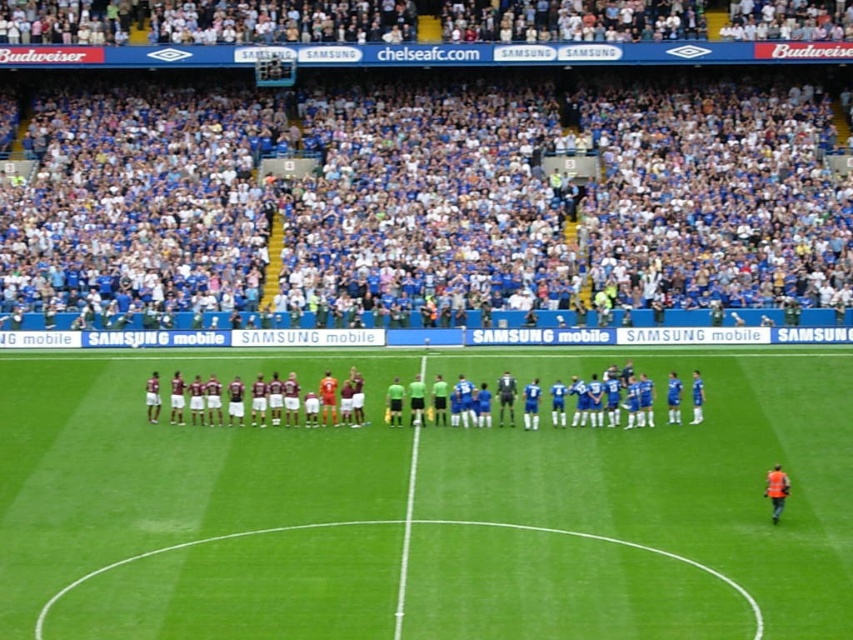
Question: Does blue fabric crowd at upper center have a larger size compared to green grass line at center?

Choices:
 (A) no
 (B) yes

Answer: (B)

Question: Does green grass football field at center appear on the left side of maroon jersey at center?

Choices:
 (A) no
 (B) yes

Answer: (A)

Question: Which object is closer to the camera taking this photo?

Choices:
 (A) maroon jersey at center
 (B) green grass line at center

Answer: (B)

Question: Does maroon jersey at center have a lesser width compared to green grass line at center?

Choices:
 (A) yes
 (B) no

Answer: (B)

Question: Which object appears farthest from the camera in this image?

Choices:
 (A) green grass football field at center
 (B) blue fabric crowd at upper center
 (C) green grass line at center
 (D) maroon jersey at center

Answer: (B)

Question: Among these points, which one is nearest to the camera?

Choices:
 (A) (489, 150)
 (B) (320, 403)
 (C) (350, 513)

Answer: (C)